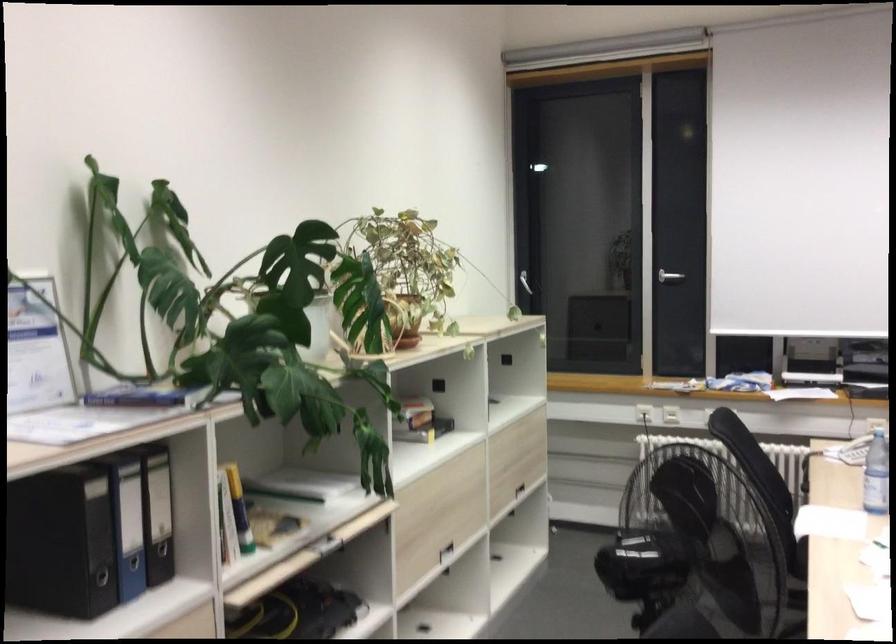
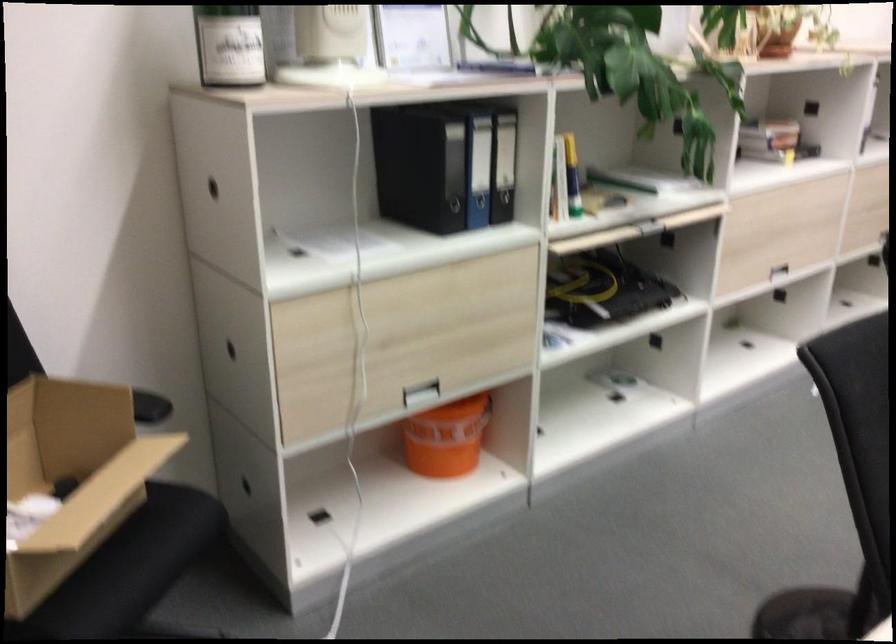
Find the pixel in the second image that matches (161,516) in the first image.

(504, 165)